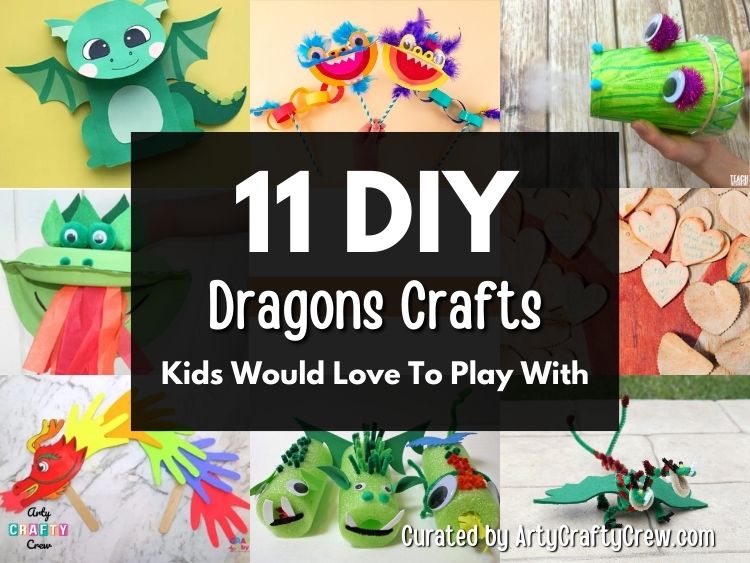
At what (x,y) coordinates should I click in order to perform the action: click on stone tiles. Please return your answer as a coordinate pair (x, y). The width and height of the screenshot is (750, 563). Looking at the image, I should click on (736, 445).